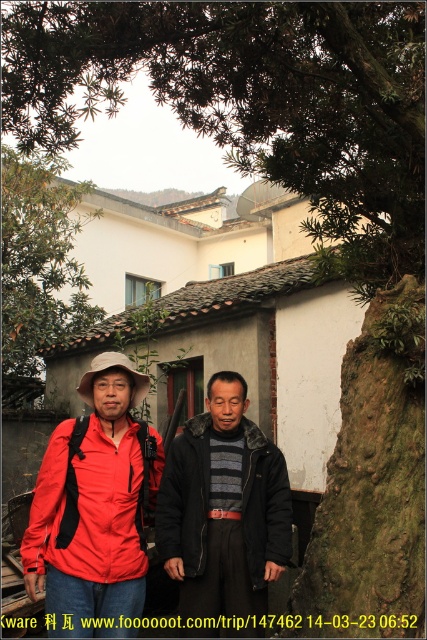
From the picture: Can you confirm if matte red jacket at left is shorter than dark gray woolen jacket at center?

Yes.

Who is higher up, matte red jacket at left or dark gray woolen jacket at center?

matte red jacket at left

Is point (108, 484) farther from camera compared to point (263, 560)?

No, (108, 484) is closer to viewer.

This screenshot has height=640, width=427. I want to click on matte red jacket at left, so click(91, 502).

Is matte red jacket at center thinner than dark gray woolen jacket at center?

In fact, matte red jacket at center might be wider than dark gray woolen jacket at center.

How much distance is there between matte red jacket at center and dark gray woolen jacket at center?

A distance of 7.10 inches exists between matte red jacket at center and dark gray woolen jacket at center.

What do you see at coordinates (94, 506) in the screenshot? I see `matte red jacket at center` at bounding box center [94, 506].

Identify the location of matte red jacket at center. (94, 506).

Looking at this image, can you confirm if matte red jacket at center is positioned above matte red jacket at left?

No, matte red jacket at center is not above matte red jacket at left.

Which is below, matte red jacket at center or matte red jacket at left?

Positioned lower is matte red jacket at center.

Identify the location of matte red jacket at center. This screenshot has height=640, width=427. (94, 506).